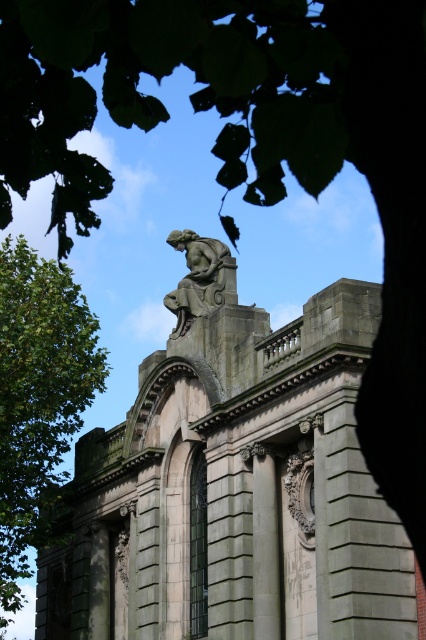
Who is higher up, green leafy tree at left or bronze statue at upper center?

bronze statue at upper center is above.

Is point (57, 486) positioned before point (187, 244)?

No, (57, 486) is behind (187, 244).

Where is `green leafy tree at left`? The height and width of the screenshot is (640, 426). green leafy tree at left is located at coordinates (39, 397).

This screenshot has width=426, height=640. Describe the element at coordinates (233, 483) in the screenshot. I see `gray stone statue at upper center` at that location.

Does gray stone statue at upper center appear over green leafy tree at left?

Yes.

You are a GUI agent. You are given a task and a screenshot of the screen. Output one action in this format:
    pyautogui.click(x=<x>, y=<y>)
    Task: Click on the gray stone statue at upper center
    This screenshot has height=640, width=426.
    Given the screenshot: What is the action you would take?
    pyautogui.click(x=233, y=483)

Measure the distance from gray stone statue at upper center to bronze statue at upper center.

The distance of gray stone statue at upper center from bronze statue at upper center is 39.44 feet.

In the scene shown: Between gray stone statue at upper center and bronze statue at upper center, which one appears on the left side from the viewer's perspective?

Positioned to the left is gray stone statue at upper center.

Between point (40, 566) and point (215, 291), which one is positioned behind?

The point (40, 566) is more distant.

At what (x,y) coordinates should I click in order to perform the action: click on gray stone statue at upper center. Please return your answer as a coordinate pair (x, y). Image resolution: width=426 pixels, height=640 pixels. Looking at the image, I should click on (233, 483).